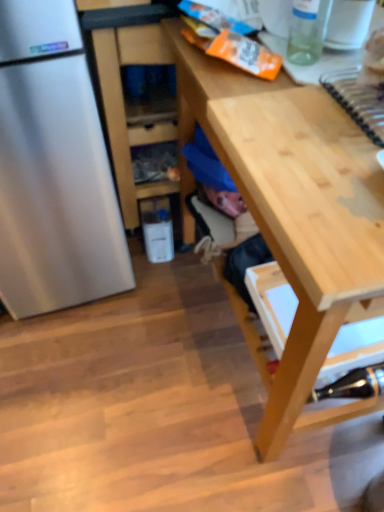
Image resolution: width=384 pixels, height=512 pixels. What are the coordinates of `free space to the left of light wood desk at center` in the screenshot? It's located at (117, 367).